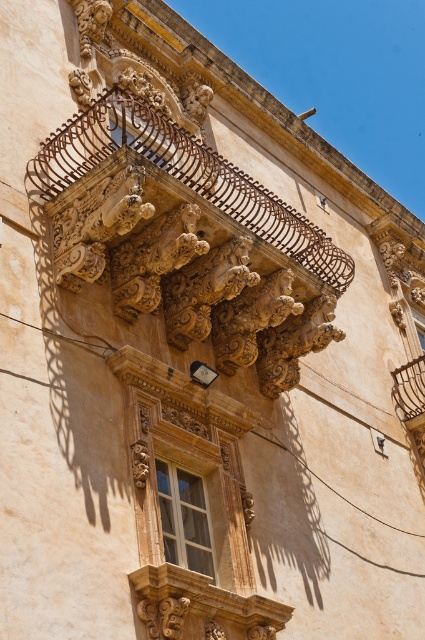
Looking at this image, is carved stone balcony at upper center positioned at the back of matte wood window at center?

Yes, carved stone balcony at upper center is behind matte wood window at center.

Does carved stone balcony at upper center have a greater width compared to matte wood window at center?

Indeed, carved stone balcony at upper center has a greater width compared to matte wood window at center.

Between point (102, 120) and point (183, 518), which one is positioned behind?

The point (183, 518) is behind.

Locate an element on the screen. This screenshot has height=640, width=425. carved stone balcony at upper center is located at coordinates (184, 177).